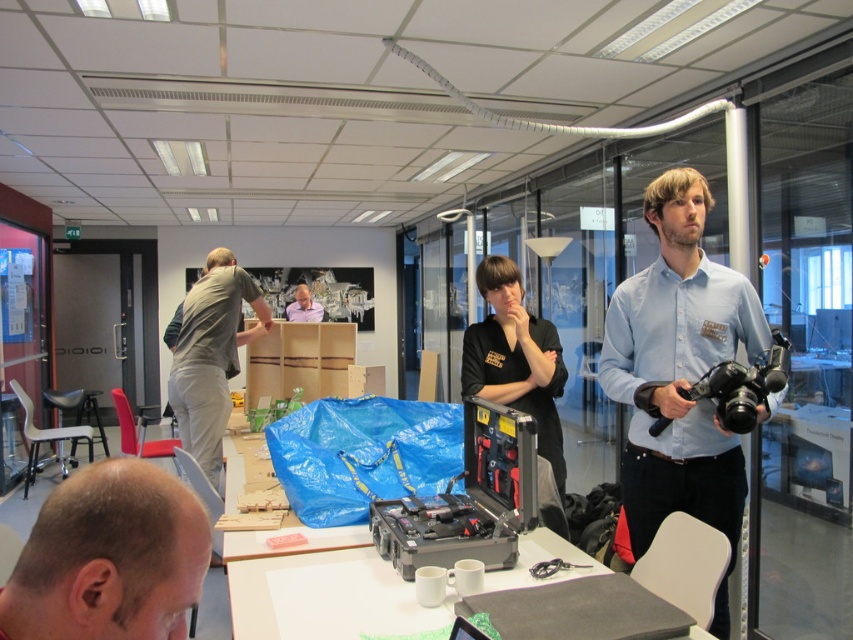
Question: Which of these objects is positioned closest to the white matte table at center?

Choices:
 (A) black plastic video camera at center
 (B) light blue shirt at center
 (C) bald head at lower left

Answer: (B)

Question: Is light blue shirt at center below white matte table at center?

Choices:
 (A) no
 (B) yes

Answer: (A)

Question: Is black matte toolbox at center below black plastic video camera at center?

Choices:
 (A) no
 (B) yes

Answer: (A)

Question: From the image, what is the correct spatial relationship of black matte toolbox at center in relation to matte white shirt at center?

Choices:
 (A) right
 (B) left

Answer: (A)

Question: Which of the following is the closest to the observer?

Choices:
 (A) black plastic video camera at center
 (B) matte white shirt at center
 (C) black plastic toolbox at center

Answer: (C)

Question: Which point appears farthest from the camera in this image?

Choices:
 (A) (287, 310)
 (B) (108, 566)
 (C) (230, 588)
 (D) (183, 346)

Answer: (A)